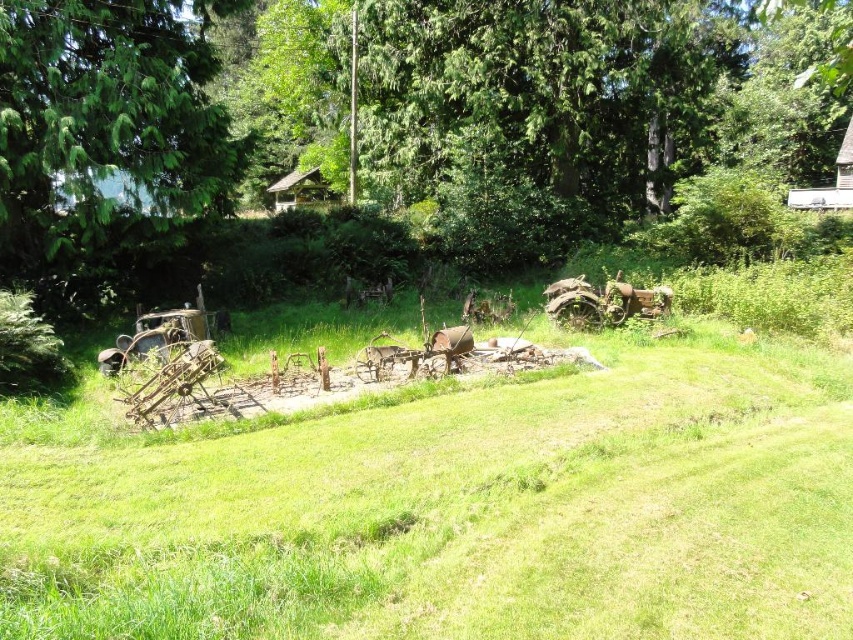
Question: Considering the real-world distances, which object is closest to the green textured tree at left?

Choices:
 (A) green leafy tree at center
 (B) wooden hut at center

Answer: (A)

Question: Considering the relative positions of green leafy tree at center and green textured tree at left in the image provided, where is green leafy tree at center located with respect to green textured tree at left?

Choices:
 (A) above
 (B) below

Answer: (A)

Question: Does green leafy tree at center come behind wooden hut at upper right?

Choices:
 (A) yes
 (B) no

Answer: (B)

Question: Which object is the farthest from the wooden hut at upper right?

Choices:
 (A) green textured tree at left
 (B) wooden hut at center
 (C) green leafy tree at center

Answer: (A)

Question: Can you confirm if green textured tree at left is positioned above wooden hut at center?

Choices:
 (A) yes
 (B) no

Answer: (B)

Question: Which point appears farthest from the camera in this image?

Choices:
 (A) [207, 12]
 (B) [70, 61]
 (C) [335, 198]
 (D) [833, 202]

Answer: (C)